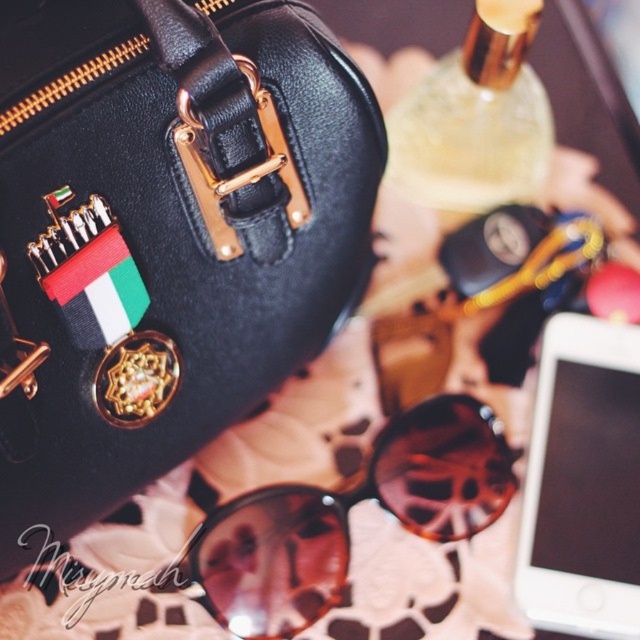
What do you see at coordinates (163, 234) in the screenshot? This screenshot has height=640, width=640. I see `black leather handbag at upper left` at bounding box center [163, 234].

How much distance is there between black leather handbag at upper left and brown matte sunglasses at center?

The distance of black leather handbag at upper left from brown matte sunglasses at center is 13.07 inches.

The height and width of the screenshot is (640, 640). I want to click on black leather handbag at upper left, so click(x=163, y=234).

Is point (52, 64) positioned before point (593, 545)?

Yes, point (52, 64) is closer to viewer.

From the picture: Who is taller, black leather handbag at upper left or white matte smartphone at lower right?

black leather handbag at upper left

This screenshot has width=640, height=640. Describe the element at coordinates (163, 234) in the screenshot. I see `black leather handbag at upper left` at that location.

The height and width of the screenshot is (640, 640). Identify the location of black leather handbag at upper left. (163, 234).

Is brown matte sunglasses at center to the left of white matte smartphone at lower right from the viewer's perspective?

Correct, you'll find brown matte sunglasses at center to the left of white matte smartphone at lower right.

Does brown matte sunglasses at center appear under white matte smartphone at lower right?

Indeed, brown matte sunglasses at center is positioned under white matte smartphone at lower right.

Between point (435, 492) and point (627, 630), which one is positioned in front?

Point (627, 630)

This screenshot has width=640, height=640. What are the coordinates of `brown matte sunglasses at center` in the screenshot? It's located at (346, 518).